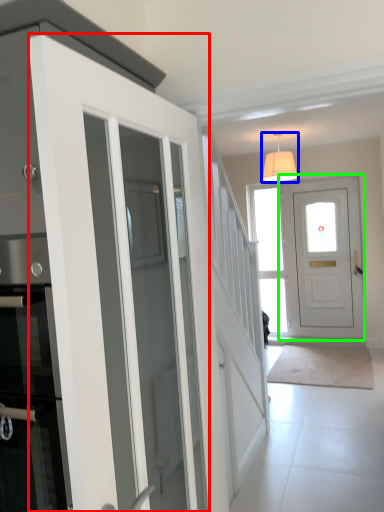
Question: Which is nearer to the door (highlighted by a red box)? lamp (highlighted by a blue box) or door (highlighted by a green box).

Choices:
 (A) lamp
 (B) door

Answer: (A)